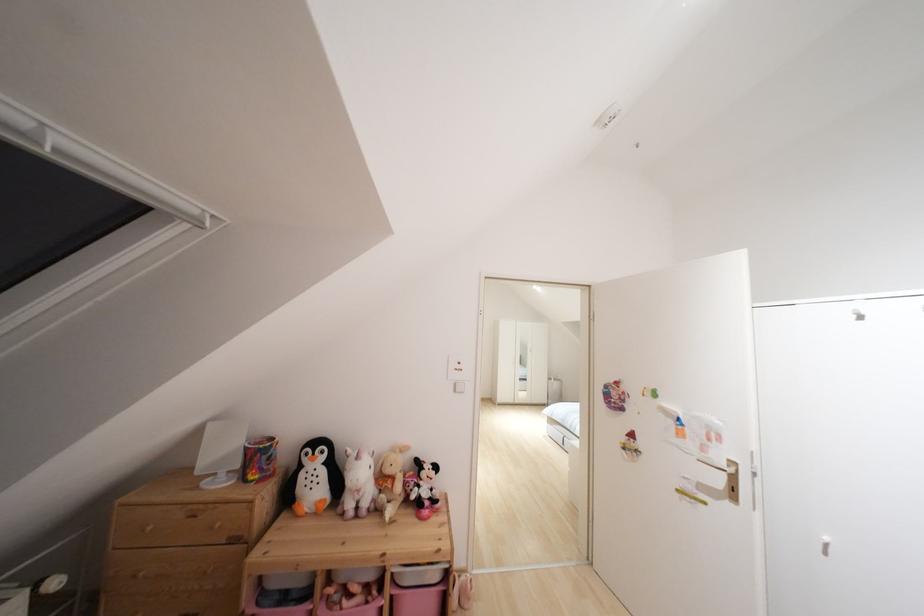
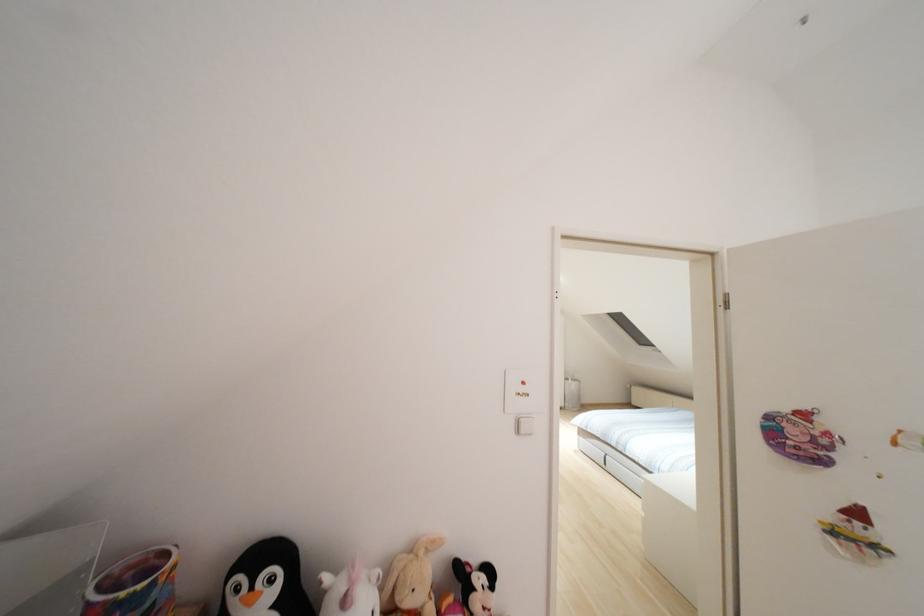
In the second image, find the point that corresponds to point 271,445 in the first image.

(152, 584)